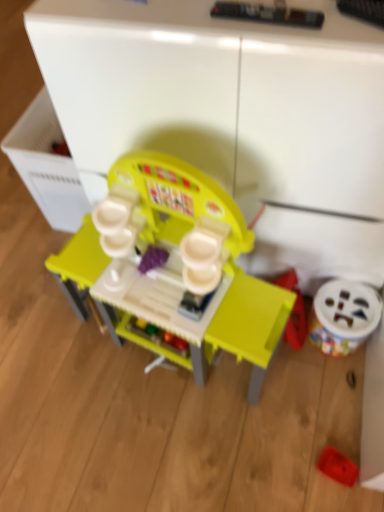
Question: Is matte plastic play kitchen at center, the first toy when ordered from left to right, taller than white plastic drawer at left?

Choices:
 (A) no
 (B) yes

Answer: (B)

Question: Is matte plastic play kitchen at center, positioned as the 3th toy in right-to-left order, shorter than white plastic drawer at left?

Choices:
 (A) no
 (B) yes

Answer: (A)

Question: Considering the relative positions of matte plastic play kitchen at center, the first toy when ordered from left to right, and white plastic drawer at left in the image provided, is matte plastic play kitchen at center, the first toy when ordered from left to right, to the right of white plastic drawer at left from the viewer's perspective?

Choices:
 (A) no
 (B) yes

Answer: (B)

Question: Would you say matte plastic play kitchen at center, the first toy when ordered from left to right, contains white plastic drawer at left?

Choices:
 (A) yes
 (B) no

Answer: (B)

Question: From the image's perspective, is matte plastic play kitchen at center, the first toy when ordered from left to right, on top of white plastic drawer at left?

Choices:
 (A) no
 (B) yes

Answer: (A)

Question: Does matte plastic play kitchen at center, positioned as the 3th toy in right-to-left order, lie behind white plastic drawer at left?

Choices:
 (A) yes
 (B) no

Answer: (B)

Question: Does white plastic toy at lower right, which appears as the first toy when viewed from the right, appear on the right side of white plastic drawer at left?

Choices:
 (A) yes
 (B) no

Answer: (A)

Question: From a real-world perspective, does white plastic toy at lower right, the third toy when ordered from left to right, stand above white plastic drawer at left?

Choices:
 (A) no
 (B) yes

Answer: (A)

Question: From a real-world perspective, does white plastic toy at lower right, which appears as the first toy when viewed from the right, sit lower than white plastic drawer at left?

Choices:
 (A) no
 (B) yes

Answer: (B)

Question: Does white plastic toy at lower right, which appears as the first toy when viewed from the right, have a greater width compared to white plastic drawer at left?

Choices:
 (A) yes
 (B) no

Answer: (B)

Question: Considering the relative sizes of white plastic toy at lower right, the third toy when ordered from left to right, and white plastic drawer at left in the image provided, is white plastic toy at lower right, the third toy when ordered from left to right, smaller than white plastic drawer at left?

Choices:
 (A) no
 (B) yes

Answer: (B)

Question: Considering the relative sizes of white plastic toy at lower right, which appears as the first toy when viewed from the right, and white plastic drawer at left in the image provided, is white plastic toy at lower right, which appears as the first toy when viewed from the right, thinner than white plastic drawer at left?

Choices:
 (A) yes
 (B) no

Answer: (A)

Question: Can you confirm if white plastic drawer at left is bigger than rubberized red tray at lower right, the second toy from the right?

Choices:
 (A) no
 (B) yes

Answer: (B)